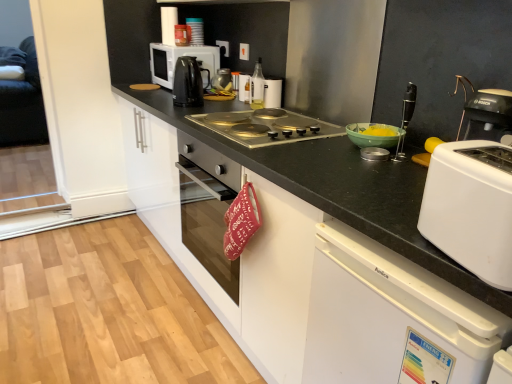
At what (x,y) coordinates should I click in order to perform the action: click on free spot in front of metallic silver kettle at center, the 4th kitchen appliance when ordered from right to left. Please return your answer as a coordinate pair (x, y). This screenshot has height=384, width=512. Looking at the image, I should click on (221, 95).